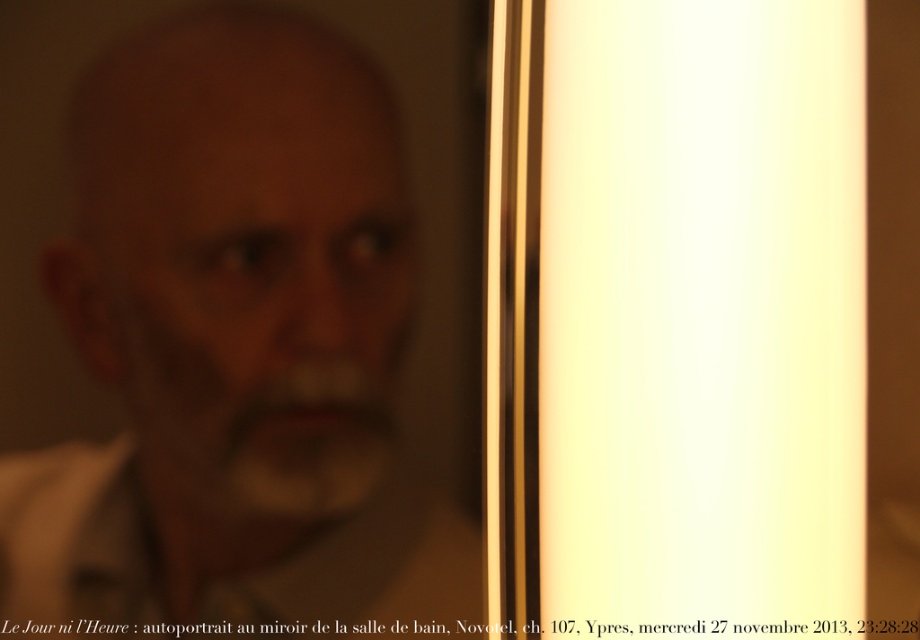
You are a photographer adjusting the camera settings in a dimly lit bathroom. You notice the matte white face at center and the white cotton dress shirt at left in your viewfinder. Which object will require you to adjust the exposure settings more to avoid overexposure?

The matte white face at center requires more exposure adjustment because its larger width compared to the white cotton dress shirt at left means it occupies more of the frame and may reflect more light, leading to overexposure if not properly adjusted.

You are standing in a bathroom and see your reflection in the mirror. You notice a bright light source coming from the right side of the mirror. If you want to avoid the glare from the light, which direction should you move your head to look at the point marked as point (368, 576), which is the white cotton dress shirt at left?

You should move your head to the left to avoid the glare from the bright light on the right side and look at the point (368, 576), which is the white cotton dress shirt at left.